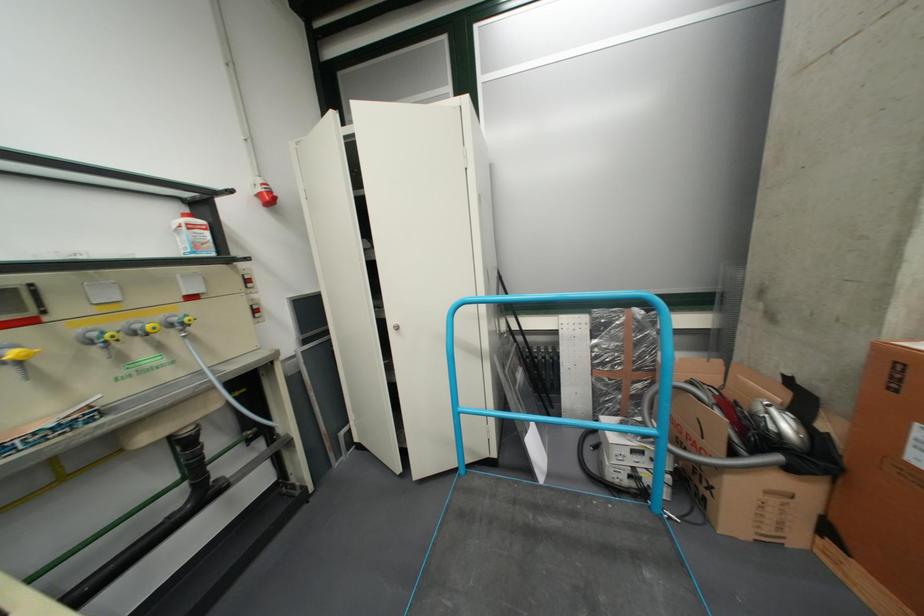
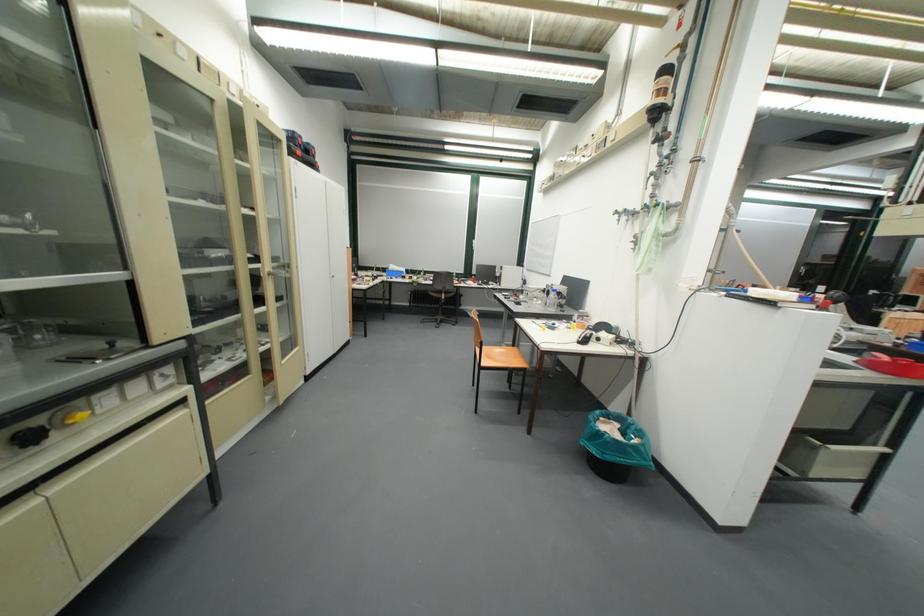
Question: I am providing you with two images of the same scene from different viewpoints. After the viewpoint changes to image2, which objects are now occluded?

Choices:
 (A) beige toilet tank lid
 (B) orange chair surface
 (C) blue cart handle
 (D) red plastic tray

Answer: (C)